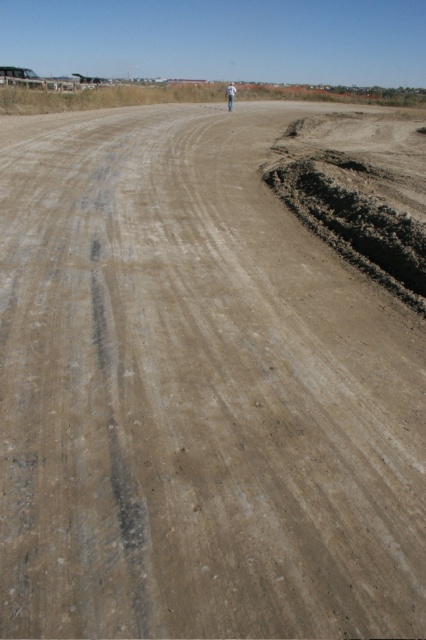
Does dark brown clay at right come behind light brown skin at center?

No, it is not.

Between dark brown clay at right and light brown skin at center, which one has more height?

Standing taller between the two is light brown skin at center.

Is point (278, 195) closer to viewer compared to point (226, 96)?

Yes, point (278, 195) is closer to viewer.

The height and width of the screenshot is (640, 426). Identify the location of dark brown clay at right. (359, 195).